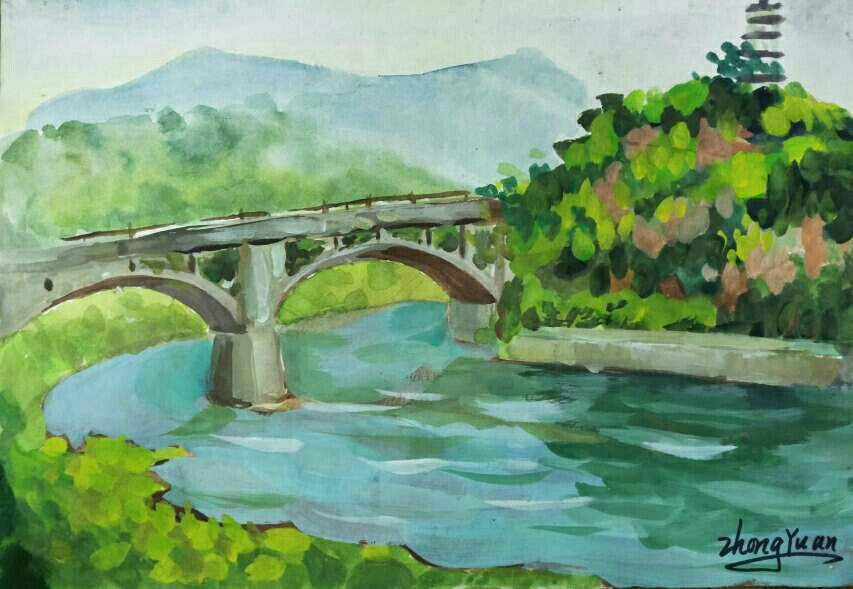
Find the location of a particular element. painting is located at coordinates (599, 492).